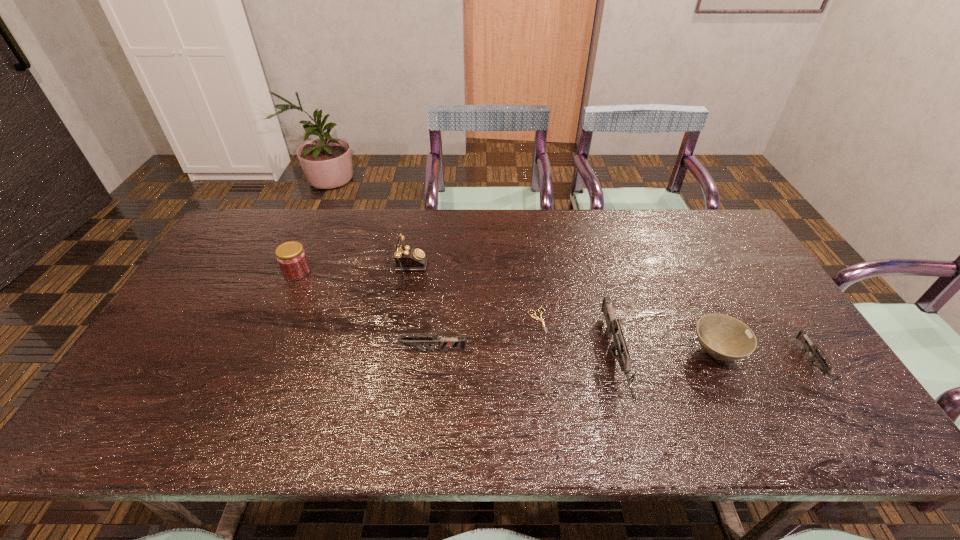
Given the evenly spaced guns in the image, where should an extra gun be added on the left to preserve the spacing? Please point to a vacant space. Please provide its 2D coordinates. Your answer should be formatted as a tuple, i.e. [(x, y)], where the tuple contains the x and y coordinates of a point satisfying the conditions above.

[(237, 343)]